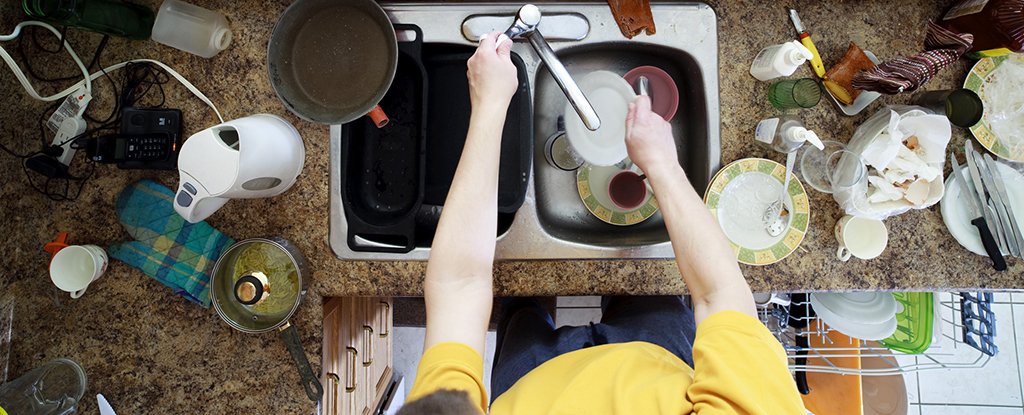
This screenshot has width=1024, height=415. What are the coordinates of `electric kettle` in the screenshot? It's located at (249, 141).